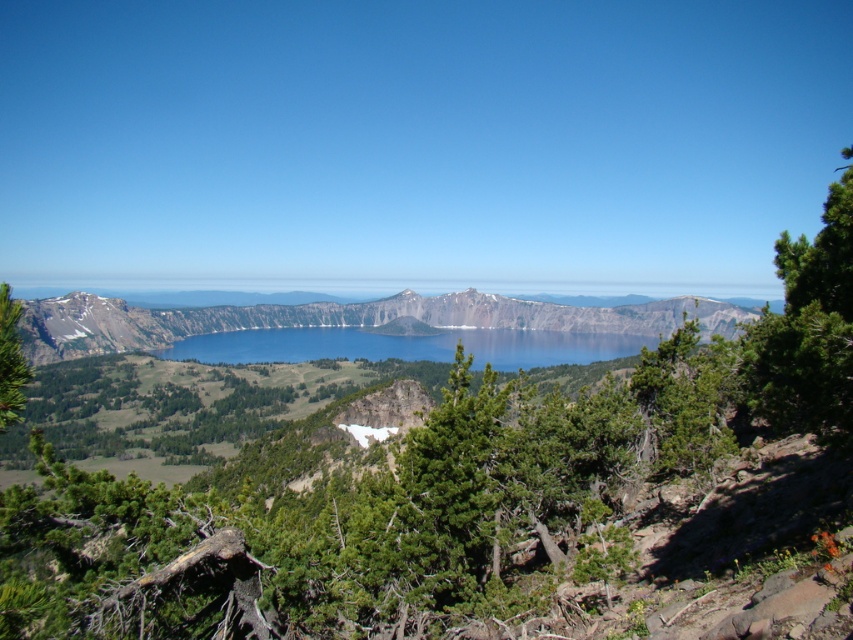
Question: Which object appears closest to the camera in this image?

Choices:
 (A) green textured pine tree at left
 (B) blue glassy water at center

Answer: (A)

Question: Can you confirm if blue glassy water at center is positioned above green textured pine tree at left?

Choices:
 (A) no
 (B) yes

Answer: (A)

Question: Which of the following is the farthest from the observer?

Choices:
 (A) green textured pine tree at left
 (B) blue glassy water at center

Answer: (B)

Question: Where is blue glassy water at center located in relation to green textured pine tree at left in the image?

Choices:
 (A) above
 (B) below

Answer: (B)

Question: Does rocky gray mountain at center have a smaller size compared to green textured pine tree at left?

Choices:
 (A) yes
 (B) no

Answer: (B)

Question: Among these points, which one is nearest to the camera?

Choices:
 (A) (10, 333)
 (B) (160, 308)

Answer: (A)